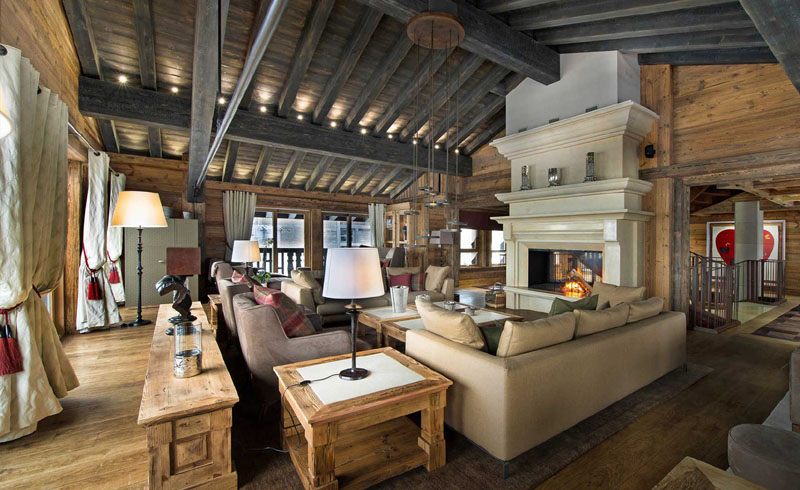
The height and width of the screenshot is (490, 800). In order to click on table in this screenshot , I will do `click(344, 387)`.